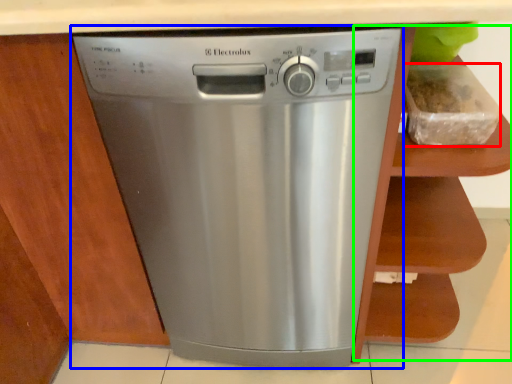
Question: Which object is the farthest from food (highlighted by a red box)? Choose among these: home appliance (highlighted by a blue box) or cabinet (highlighted by a green box).

Choices:
 (A) home appliance
 (B) cabinet

Answer: (A)